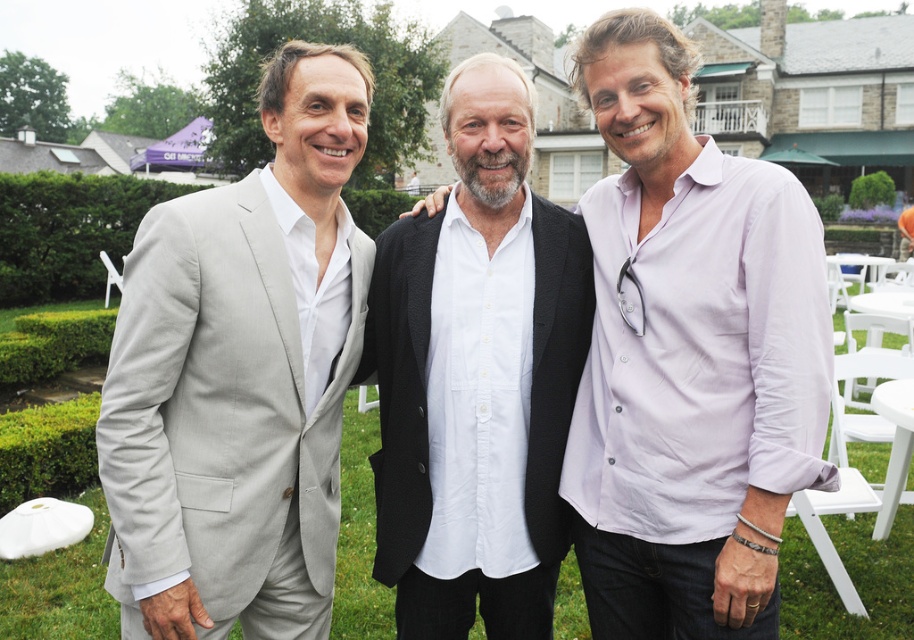
You are a photographer at a social event. You need to adjust the camera focus to capture both the light gray suit at left and the white cotton shirt at center clearly. Which one should you focus on first to ensure proper depth of field?

The light gray suit at left is above the white cotton shirt at center, so focusing on the light gray suit at left first will help ensure both are in focus due to its higher position.